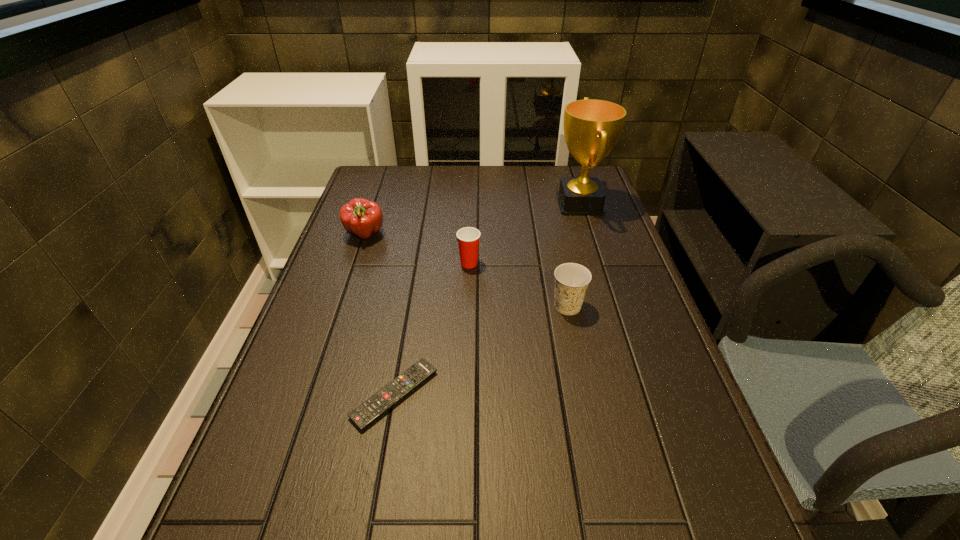
Where is `award`? This screenshot has width=960, height=540. award is located at coordinates (592, 127).

This screenshot has width=960, height=540. In order to click on the leftmost object in this screenshot , I will do `click(360, 217)`.

Find the location of a particular element. This screenshot has width=960, height=540. the right Dixie cup is located at coordinates (571, 280).

The height and width of the screenshot is (540, 960). I want to click on the second nearest object, so pyautogui.click(x=571, y=280).

You are a GUI agent. You are given a task and a screenshot of the screen. Output one action in this format:
    pyautogui.click(x=<x>, y=<y>)
    Task: Click on the third object from left to right
    
    Given the screenshot: What is the action you would take?
    pyautogui.click(x=468, y=238)

At what (x,y) coordinates should I click in order to perform the action: click on the third farthest object. Please return your answer as a coordinate pair (x, y). The width and height of the screenshot is (960, 540). Looking at the image, I should click on coord(468,238).

At what (x,y) coordinates should I click in order to perform the action: click on the fourth object from right to left. Please return your answer as a coordinate pair (x, y). Image resolution: width=960 pixels, height=540 pixels. Looking at the image, I should click on (365, 414).

Image resolution: width=960 pixels, height=540 pixels. Identify the location of remote control. (365, 414).

Locate an element on the screen. vacant position located 0.050m on the front-facing side of the award is located at coordinates (539, 204).

Find the location of a particular element. The image size is (960, 540). vacant area situated 0.290m on the front-facing side of the award is located at coordinates (465, 204).